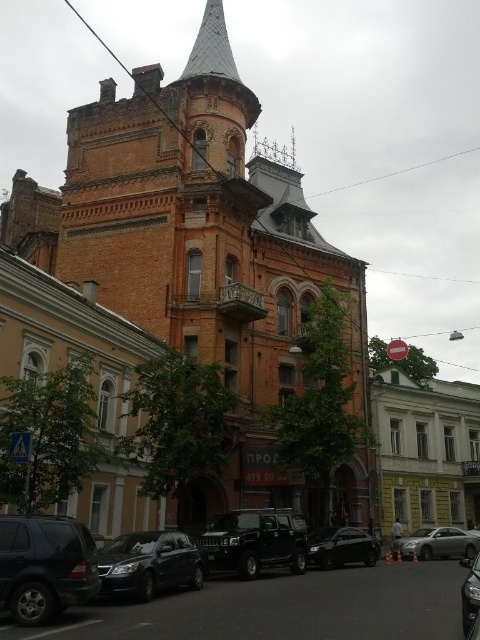
You are a delivery driver who needs to park your van between the shiny black sedan at lower left and the shiny silver car at center. Your van is 6 meters long. Is there enough space between them to park your van?

The distance between the shiny black sedan at lower left and the shiny silver car at center is 17.28 meters. Since your van is only 6 meters long, there is sufficient space to park between them.

You are a delivery person needing to park your 4.5 meter long van. You see the shiny black sedan at lower left and the shiny silver car at center parked on the street. Which parking spot between them can accommodate your van?

The shiny silver car at center is longer than the shiny black sedan at lower left. Since your van is 4.5 meters long, the parking spot near the shiny silver car at center would be more suitable as it likely has enough space.